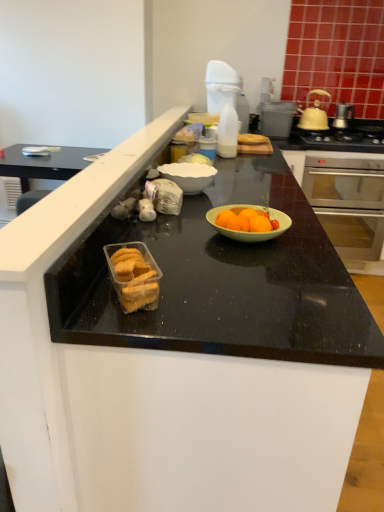
Locate an element on the screen. free spot below yellow matte pot at upper right, positioned as the 1th pot/pan in left-to-right order (from a real-world perspective) is located at coordinates (305, 125).